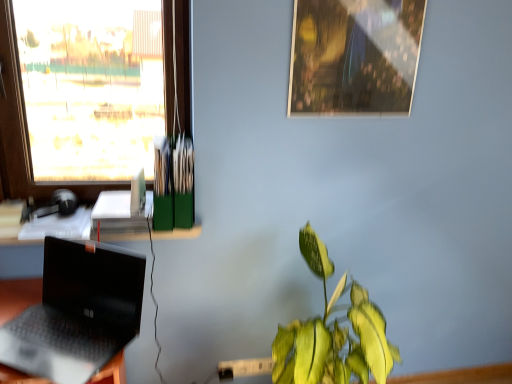
Question: Should I look upward or downward to see green glossy leafy plant at lower right?

Choices:
 (A) down
 (B) up

Answer: (A)

Question: Is transparent glass window at upper left oriented towards white plastic power outlet at lower center?

Choices:
 (A) no
 (B) yes

Answer: (A)

Question: From a real-world perspective, is transparent glass window at upper left located beneath white plastic power outlet at lower center?

Choices:
 (A) no
 (B) yes

Answer: (A)

Question: Could white plastic power outlet at lower center be considered to be inside transparent glass window at upper left?

Choices:
 (A) yes
 (B) no

Answer: (B)

Question: Considering the relative sizes of transparent glass window at upper left and white plastic power outlet at lower center in the image provided, is transparent glass window at upper left smaller than white plastic power outlet at lower center?

Choices:
 (A) yes
 (B) no

Answer: (B)

Question: Can you confirm if transparent glass window at upper left is taller than white plastic power outlet at lower center?

Choices:
 (A) no
 (B) yes

Answer: (B)

Question: From the image's perspective, does transparent glass window at upper left appear lower than white plastic power outlet at lower center?

Choices:
 (A) no
 (B) yes

Answer: (A)

Question: Considering the relative positions of transparent glass window at upper left and green glossy leafy plant at lower right in the image provided, is transparent glass window at upper left in front of green glossy leafy plant at lower right?

Choices:
 (A) yes
 (B) no

Answer: (B)

Question: Is transparent glass window at upper left wider than green glossy leafy plant at lower right?

Choices:
 (A) yes
 (B) no

Answer: (B)

Question: Is transparent glass window at upper left completely or partially outside of green glossy leafy plant at lower right?

Choices:
 (A) yes
 (B) no

Answer: (A)

Question: From the image's perspective, is transparent glass window at upper left over green glossy leafy plant at lower right?

Choices:
 (A) no
 (B) yes

Answer: (B)

Question: Is transparent glass window at upper left positioned far away from green glossy leafy plant at lower right?

Choices:
 (A) no
 (B) yes

Answer: (B)

Question: From a real-world perspective, is transparent glass window at upper left on top of green glossy leafy plant at lower right?

Choices:
 (A) no
 (B) yes

Answer: (B)

Question: From a real-world perspective, is metallic reflective photo frame at upper center over white plastic power outlet at lower center?

Choices:
 (A) yes
 (B) no

Answer: (A)